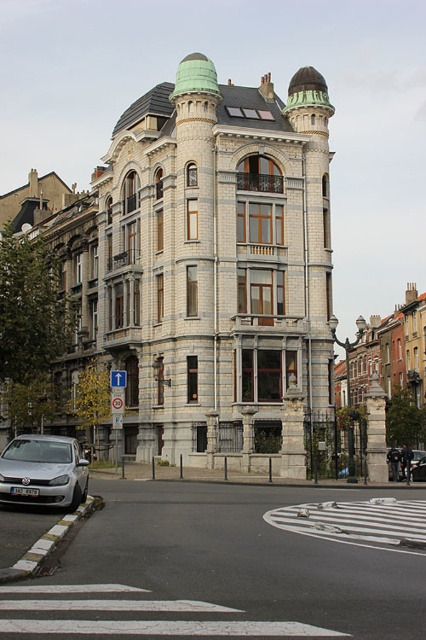
Question: Which object is positioned farthest from the metallic silver car at center?

Choices:
 (A) white asphalt at center
 (B) silver metallic car at lower left

Answer: (A)

Question: Which is nearer to the metallic silver car at center?

Choices:
 (A) white asphalt at center
 (B) silver metallic car at lower left

Answer: (B)

Question: Is white asphalt at center to the right of metallic silver car at center from the viewer's perspective?

Choices:
 (A) no
 (B) yes

Answer: (A)

Question: Considering the relative positions of white asphalt at center and metallic silver car at center in the image provided, where is white asphalt at center located with respect to metallic silver car at center?

Choices:
 (A) right
 (B) left

Answer: (B)

Question: Which point is farther to the camera?

Choices:
 (A) silver metallic car at lower left
 (B) white asphalt at center

Answer: (A)

Question: Does white asphalt at center appear under silver metallic car at lower left?

Choices:
 (A) no
 (B) yes

Answer: (B)